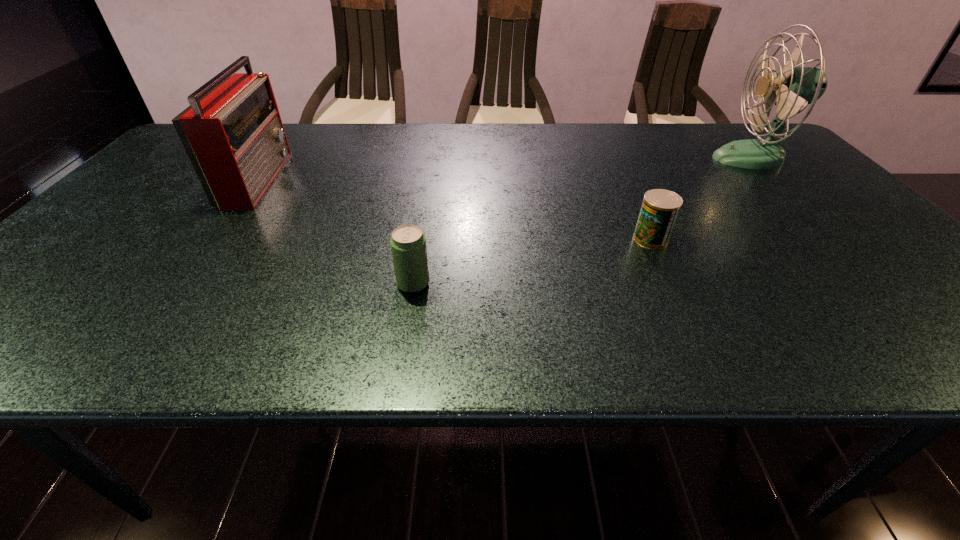
Image resolution: width=960 pixels, height=540 pixels. What are the coordinates of `free space at the right edge of the desktop` in the screenshot? It's located at (821, 220).

Image resolution: width=960 pixels, height=540 pixels. Identify the location of vacant space at the far right corner. (728, 125).

At what (x,y) coordinates should I click in order to perform the action: click on free space between the fan and the radio receiver. Please return your answer as a coordinate pair (x, y). This screenshot has height=540, width=960. Looking at the image, I should click on (505, 168).

What are the coordinates of `free area in between the leftmost object and the tallest object` in the screenshot? It's located at (505, 168).

At what (x,y) coordinates should I click in order to perform the action: click on vacant space in between the soda and the fan. Please return your answer as a coordinate pair (x, y). This screenshot has width=960, height=540. Looking at the image, I should click on (583, 221).

I want to click on free spot between the second object from right to left and the tallest object, so click(702, 199).

Find the location of `vacant region between the can and the rightmost object`. vacant region between the can and the rightmost object is located at coordinates (702, 199).

Image resolution: width=960 pixels, height=540 pixels. I want to click on unoccupied position between the can and the fan, so click(x=702, y=199).

Where is `vacant space that is in between the second nearest object and the fan`? vacant space that is in between the second nearest object and the fan is located at coordinates (702, 199).

Locate an element on the screen. The height and width of the screenshot is (540, 960). vacant space that's between the radio receiver and the rightmost object is located at coordinates (505, 168).